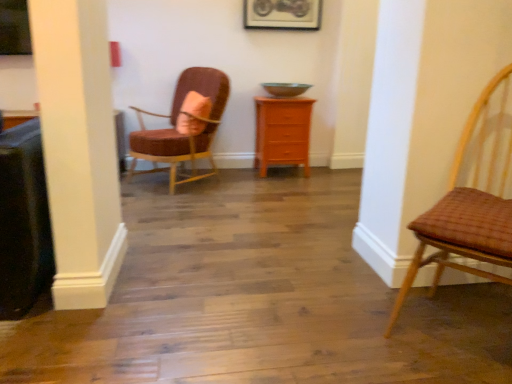
Image resolution: width=512 pixels, height=384 pixels. I want to click on woven brown chair at right, the second chair viewed from the back, so click(x=467, y=210).

This screenshot has width=512, height=384. Describe the element at coordinates (282, 14) in the screenshot. I see `metallic silver picture frame at upper center` at that location.

Find the location of a particular element. The image size is (512, 384). woven brown chair at right, the 2th chair when ordered from left to right is located at coordinates (467, 210).

From the image's perspective, between orange wood chest of drawers at center and velvet pink chair at upper left, the second chair when ordered from front to back, who is located below?

orange wood chest of drawers at center appears lower in the image.

From a real-world perspective, is orange wood chest of drawers at center positioned over velvet pink chair at upper left, the first chair from the left, based on gravity?

Actually, orange wood chest of drawers at center is physically below velvet pink chair at upper left, the first chair from the left, in the real world.

Between orange wood chest of drawers at center and velvet pink chair at upper left, the first chair from the left, which one is positioned in front?

velvet pink chair at upper left, the first chair from the left, is closer to the camera.

You are a GUI agent. You are given a task and a screenshot of the screen. Output one action in this format:
    pyautogui.click(x=<x>, y=<y>)
    Task: Click on the pillow on the right of velvet pink chair at upper left, which ranks as the first chair in back-to-front order
    The width and height of the screenshot is (512, 384).
    Given the screenshot: What is the action you would take?
    pyautogui.click(x=193, y=114)

How different are the orientations of velvet pink chair at upper left, which is the second chair from right to left, and pink fabric pillow at center in degrees?

The angular difference between velvet pink chair at upper left, which is the second chair from right to left, and pink fabric pillow at center is 24.6 degrees.

Is velvet pink chair at upper left, which is the second chair from right to left, facing towards pink fabric pillow at center?

Yes, velvet pink chair at upper left, which is the second chair from right to left, is turned towards pink fabric pillow at center.

Consider the image. Measure the distance between velvet pink chair at upper left, the second chair when ordered from front to back, and pink fabric pillow at center.

velvet pink chair at upper left, the second chair when ordered from front to back, and pink fabric pillow at center are 20.43 centimeters apart from each other.

Could you tell me if orange wood chest of drawers at center is turned towards metallic silver picture frame at upper center?

No, orange wood chest of drawers at center is not oriented towards metallic silver picture frame at upper center.

Could you measure the distance between orange wood chest of drawers at center and metallic silver picture frame at upper center?

orange wood chest of drawers at center and metallic silver picture frame at upper center are 36.81 inches apart from each other.

In terms of height, does orange wood chest of drawers at center look taller or shorter compared to metallic silver picture frame at upper center?

Considering their sizes, orange wood chest of drawers at center has more height than metallic silver picture frame at upper center.

Which is more to the left, orange wood chest of drawers at center or metallic silver picture frame at upper center?

metallic silver picture frame at upper center.

Is pink fabric pillow at center a part of metallic silver picture frame at upper center?

That's incorrect, pink fabric pillow at center is not inside metallic silver picture frame at upper center.

Is the depth of metallic silver picture frame at upper center greater than that of pink fabric pillow at center?

That is True.

Would you say metallic silver picture frame at upper center is a long distance from pink fabric pillow at center?

That's right, there is a large distance between metallic silver picture frame at upper center and pink fabric pillow at center.

Considering the sizes of pink fabric pillow at center and velvet pink chair at upper left, which ranks as the first chair in back-to-front order, in the image, is pink fabric pillow at center taller or shorter than velvet pink chair at upper left, which ranks as the first chair in back-to-front order,?

Clearly, pink fabric pillow at center is shorter compared to velvet pink chair at upper left, which ranks as the first chair in back-to-front order.

Is pink fabric pillow at center located outside velvet pink chair at upper left, which is the second chair from right to left?

No, most part of pink fabric pillow at center lies within velvet pink chair at upper left, which is the second chair from right to left.

Is pink fabric pillow at center placed right next to velvet pink chair at upper left, the second chair when ordered from front to back?

pink fabric pillow at center and velvet pink chair at upper left, the second chair when ordered from front to back, are not in contact.

Considering the relative positions of pink fabric pillow at center and velvet pink chair at upper left, which ranks as the first chair in back-to-front order, in the image provided, is pink fabric pillow at center to the right of velvet pink chair at upper left, which ranks as the first chair in back-to-front order, from the viewer's perspective?

Indeed, pink fabric pillow at center is positioned on the right side of velvet pink chair at upper left, which ranks as the first chair in back-to-front order.

Can you tell me how much pink fabric pillow at center and orange wood chest of drawers at center differ in facing direction?

The facing directions of pink fabric pillow at center and orange wood chest of drawers at center are 69.2 degrees apart.

From the image's perspective, is pink fabric pillow at center located above orange wood chest of drawers at center?

Yes, from the image's perspective, pink fabric pillow at center is over orange wood chest of drawers at center.

Which object is wider, pink fabric pillow at center or orange wood chest of drawers at center?

orange wood chest of drawers at center is wider.

Locate an element on the screen. The image size is (512, 384). picture frame on the left of the woven brown chair at right, placed as the first chair when sorted from right to left is located at coordinates (282, 14).

Who is shorter, woven brown chair at right, the first chair when ordered from front to back, or metallic silver picture frame at upper center?

metallic silver picture frame at upper center is shorter.

Would you say woven brown chair at right, placed as the first chair when sorted from right to left, is inside or outside metallic silver picture frame at upper center?

woven brown chair at right, placed as the first chair when sorted from right to left, exists outside the volume of metallic silver picture frame at upper center.

Does woven brown chair at right, the 2th chair when ordered from left to right, come behind metallic silver picture frame at upper center?

No, it is in front of metallic silver picture frame at upper center.

Locate an element on the screen. The width and height of the screenshot is (512, 384). chest of drawers below the velvet pink chair at upper left, which ranks as the first chair in back-to-front order (from the image's perspective) is located at coordinates (282, 132).

Find the location of a particular element. This screenshot has width=512, height=384. the 2nd chair below the pink fabric pillow at center (from a real-world perspective) is located at coordinates (178, 132).

Considering their positions, is metallic silver picture frame at upper center positioned closer to velvet pink chair at upper left, which ranks as the first chair in back-to-front order, than pink fabric pillow at center?

pink fabric pillow at center lies closer to velvet pink chair at upper left, which ranks as the first chair in back-to-front order, than the other object.

Considering their positions, is velvet pink chair at upper left, the first chair from the left, positioned closer to woven brown chair at right, the 2th chair when ordered from left to right, than pink fabric pillow at center?

pink fabric pillow at center is positioned closer to the anchor woven brown chair at right, the 2th chair when ordered from left to right.

Based on their spatial positions, is pink fabric pillow at center or woven brown chair at right, the 2th chair when ordered from left to right, closer to metallic silver picture frame at upper center?

Based on the image, pink fabric pillow at center appears to be nearer to metallic silver picture frame at upper center.

Which object lies nearer to the anchor point metallic silver picture frame at upper center, orange wood chest of drawers at center or pink fabric pillow at center?

Among the two, orange wood chest of drawers at center is located nearer to metallic silver picture frame at upper center.

Based on their spatial positions, is metallic silver picture frame at upper center or orange wood chest of drawers at center closer to woven brown chair at right, the second chair viewed from the back?

orange wood chest of drawers at center is closer to woven brown chair at right, the second chair viewed from the back.

From the image, which object appears to be farther from velvet pink chair at upper left, which is the second chair from right to left, orange wood chest of drawers at center or pink fabric pillow at center?

orange wood chest of drawers at center is further to velvet pink chair at upper left, which is the second chair from right to left.

Considering their positions, is woven brown chair at right, placed as the first chair when sorted from right to left, positioned further to pink fabric pillow at center than orange wood chest of drawers at center?

Based on the image, woven brown chair at right, placed as the first chair when sorted from right to left, appears to be further to pink fabric pillow at center.

When comparing their distances from pink fabric pillow at center, does velvet pink chair at upper left, which is the second chair from right to left, or woven brown chair at right, the 2th chair when ordered from left to right, seem further?

The object further to pink fabric pillow at center is woven brown chair at right, the 2th chair when ordered from left to right.

Where is `pillow positioned between woven brown chair at right, placed as the first chair when sorted from right to left, and metallic silver picture frame at upper center from near to far`? This screenshot has width=512, height=384. pillow positioned between woven brown chair at right, placed as the first chair when sorted from right to left, and metallic silver picture frame at upper center from near to far is located at coordinates (193, 114).

Identify the location of chest of drawers between woven brown chair at right, the 2th chair when ordered from left to right, and metallic silver picture frame at upper center, along the z-axis. The width and height of the screenshot is (512, 384). (282, 132).

You are a GUI agent. You are given a task and a screenshot of the screen. Output one action in this format:
    pyautogui.click(x=<x>, y=<y>)
    Task: Click on the pillow located between woven brown chair at right, the second chair viewed from the back, and orange wood chest of drawers at center in the depth direction
    
    Given the screenshot: What is the action you would take?
    pyautogui.click(x=193, y=114)

Identify the location of chair between metallic silver picture frame at upper center and orange wood chest of drawers at center in the up-down direction. (178, 132).